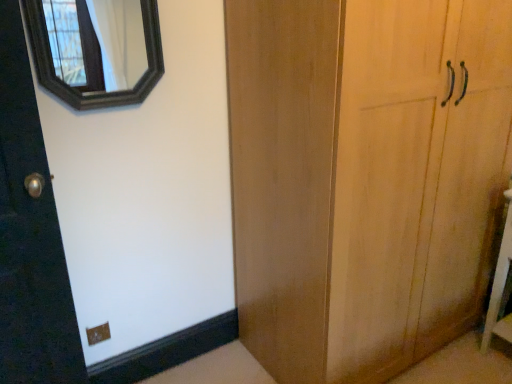
Question: Considering the relative sizes of white wood vanity at lower right and black wooden mirror at upper left in the image provided, is white wood vanity at lower right taller than black wooden mirror at upper left?

Choices:
 (A) yes
 (B) no

Answer: (A)

Question: Is white wood vanity at lower right shorter than black wooden mirror at upper left?

Choices:
 (A) no
 (B) yes

Answer: (A)

Question: Would you say white wood vanity at lower right is outside black wooden mirror at upper left?

Choices:
 (A) no
 (B) yes

Answer: (B)

Question: From the image's perspective, does white wood vanity at lower right appear higher than black wooden mirror at upper left?

Choices:
 (A) no
 (B) yes

Answer: (A)

Question: Is white wood vanity at lower right next to black wooden mirror at upper left and touching it?

Choices:
 (A) yes
 (B) no

Answer: (B)

Question: Is white wood vanity at lower right at the right side of black wooden mirror at upper left?

Choices:
 (A) yes
 (B) no

Answer: (A)

Question: Could you tell me if black wooden mirror at upper left is facing white wood vanity at lower right?

Choices:
 (A) no
 (B) yes

Answer: (A)

Question: Can you confirm if black wooden mirror at upper left is shorter than white wood vanity at lower right?

Choices:
 (A) no
 (B) yes

Answer: (B)

Question: Is black wooden mirror at upper left thinner than white wood vanity at lower right?

Choices:
 (A) no
 (B) yes

Answer: (B)

Question: Is black wooden mirror at upper left behind white wood vanity at lower right?

Choices:
 (A) yes
 (B) no

Answer: (B)

Question: From a real-world perspective, is black wooden mirror at upper left located beneath white wood vanity at lower right?

Choices:
 (A) no
 (B) yes

Answer: (A)

Question: Can we say black wooden mirror at upper left lies outside white wood vanity at lower right?

Choices:
 (A) no
 (B) yes

Answer: (B)

Question: From a real-world perspective, is white wood vanity at lower right physically located above or below black wooden mirror at upper left?

Choices:
 (A) above
 (B) below

Answer: (B)